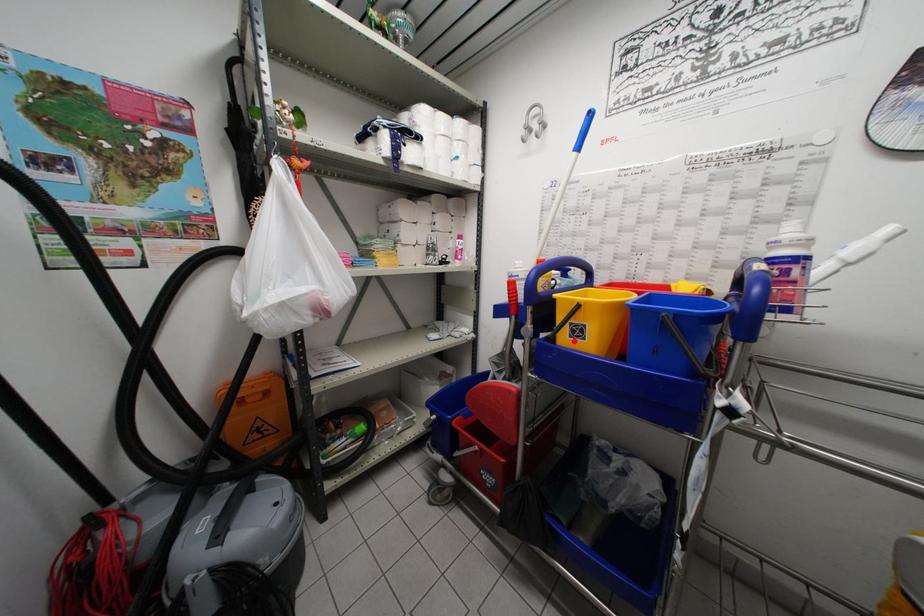
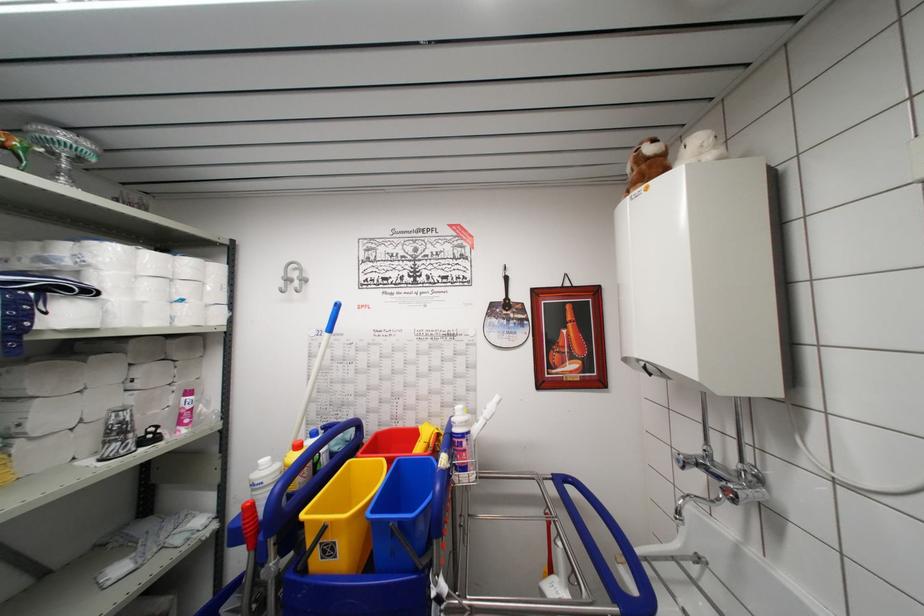
Where in the second image is the point corresponding to the highlighted location from the first image?

(325, 562)